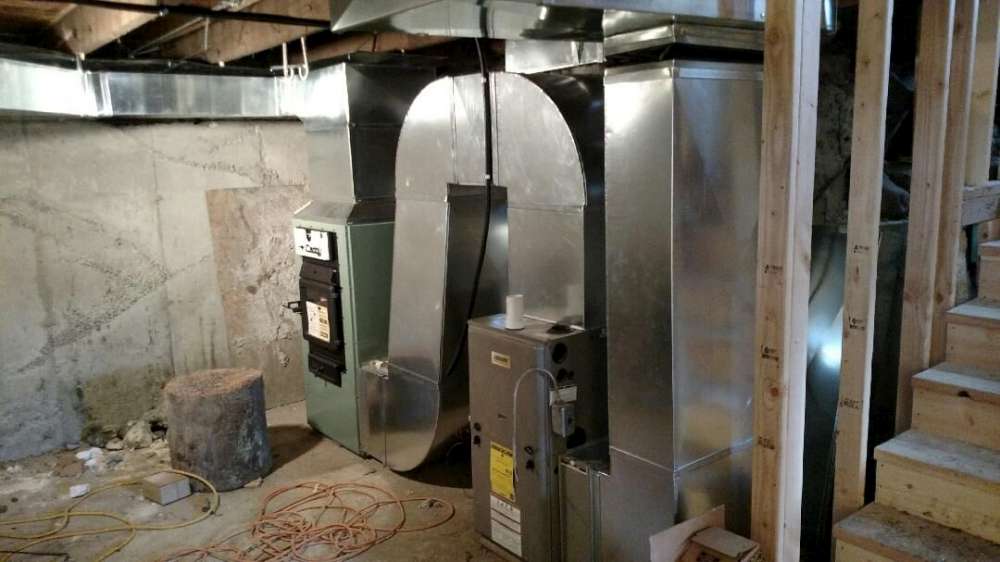
In order to click on cords in this screenshot , I will do (x=341, y=538), (x=120, y=530).